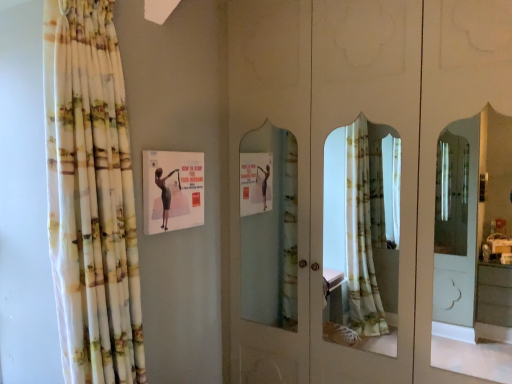
Question: Is floral fabric curtain at left completely or partially inside matte paper poster at upper center?

Choices:
 (A) yes
 (B) no

Answer: (B)

Question: Does matte paper poster at upper center have a greater height compared to floral fabric curtain at left?

Choices:
 (A) no
 (B) yes

Answer: (A)

Question: From the image's perspective, is matte paper poster at upper center on floral fabric curtain at left?

Choices:
 (A) no
 (B) yes

Answer: (B)

Question: Does matte paper poster at upper center have a smaller size compared to floral fabric curtain at left?

Choices:
 (A) no
 (B) yes

Answer: (B)

Question: Is matte paper poster at upper center oriented towards floral fabric curtain at left?

Choices:
 (A) no
 (B) yes

Answer: (A)

Question: Does matte paper poster at upper center have a lesser width compared to floral fabric curtain at left?

Choices:
 (A) no
 (B) yes

Answer: (B)

Question: Considering the relative sizes of floral fabric curtain at left and matte paper poster at upper center in the image provided, is floral fabric curtain at left shorter than matte paper poster at upper center?

Choices:
 (A) no
 (B) yes

Answer: (A)

Question: Is floral fabric curtain at left not close to matte paper poster at upper center?

Choices:
 (A) yes
 (B) no

Answer: (B)

Question: Is floral fabric curtain at left to the right of matte paper poster at upper center from the viewer's perspective?

Choices:
 (A) no
 (B) yes

Answer: (A)

Question: Considering the relative positions of floral fabric curtain at left and matte paper poster at upper center in the image provided, is floral fabric curtain at left in front of matte paper poster at upper center?

Choices:
 (A) yes
 (B) no

Answer: (A)

Question: From the image's perspective, would you say floral fabric curtain at left is shown under matte paper poster at upper center?

Choices:
 (A) no
 (B) yes

Answer: (B)

Question: Considering the relative positions of floral fabric curtain at left and matte paper poster at upper center in the image provided, is floral fabric curtain at left behind matte paper poster at upper center?

Choices:
 (A) yes
 (B) no

Answer: (B)

Question: From a real-world perspective, is matte paper poster at upper center physically located above or below floral fabric curtain at left?

Choices:
 (A) below
 (B) above

Answer: (B)